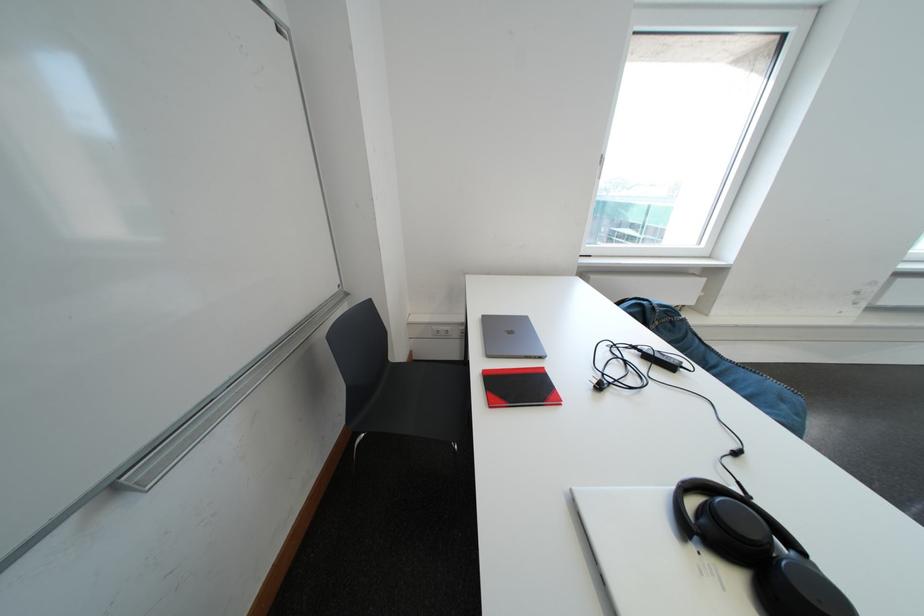
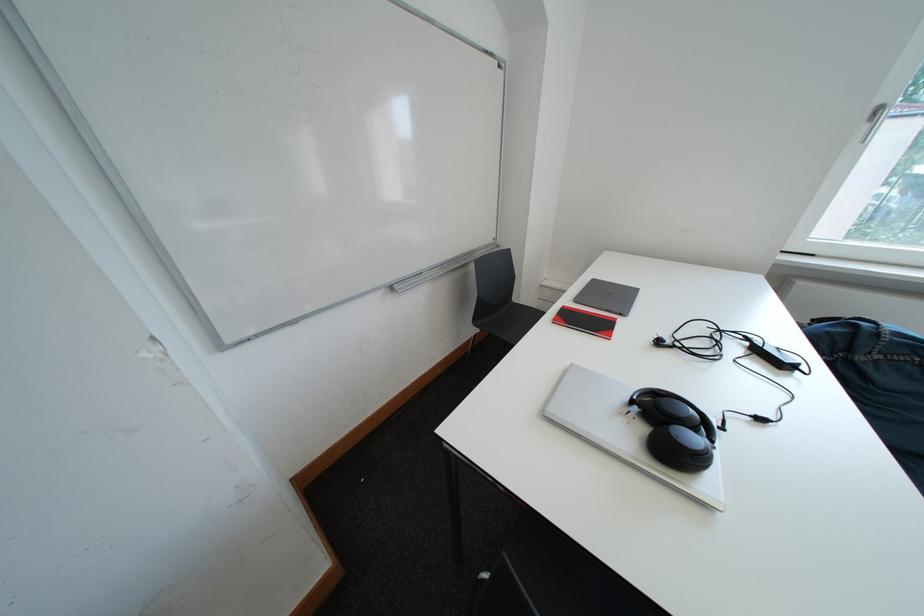
Question: The camera is either moving clockwise (left) or counter-clockwise (right) around the object. The first image is from the beginning of the video and the second image is from the end. Is the camera moving left or right when shooting the video?

Choices:
 (A) Left
 (B) Right

Answer: (B)